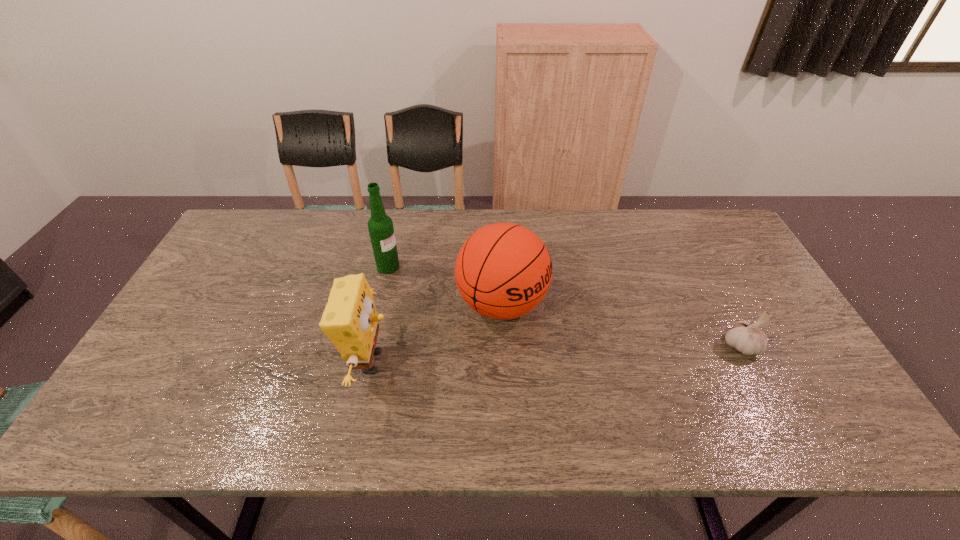
What are the coordinates of `sponge` in the screenshot? It's located at [x=350, y=320].

The height and width of the screenshot is (540, 960). Find the location of `garlic`. garlic is located at coordinates (747, 338).

Image resolution: width=960 pixels, height=540 pixels. In order to click on the rightmost object in this screenshot , I will do `click(747, 338)`.

Where is `basketball`? basketball is located at coordinates (503, 270).

This screenshot has height=540, width=960. I want to click on beer bottle, so click(380, 226).

This screenshot has height=540, width=960. I want to click on vacant space located on the face of the sponge, so click(x=465, y=362).

Where is `blank space located on the back of the rightmost object`? blank space located on the back of the rightmost object is located at coordinates (693, 255).

The height and width of the screenshot is (540, 960). I want to click on vacant position located 0.370m on the side with logo of the second object from right to left, so click(x=677, y=394).

You are a GUI agent. You are given a task and a screenshot of the screen. Output one action in this format:
    pyautogui.click(x=<x>, y=<y>)
    Task: Click on the vacant space situated on the side with logo of the second object from right to left
    
    Given the screenshot: What is the action you would take?
    pyautogui.click(x=557, y=333)

Where is `free spot located 0.310m on the side with logo of the second object from right to left`? The height and width of the screenshot is (540, 960). free spot located 0.310m on the side with logo of the second object from right to left is located at coordinates (652, 381).